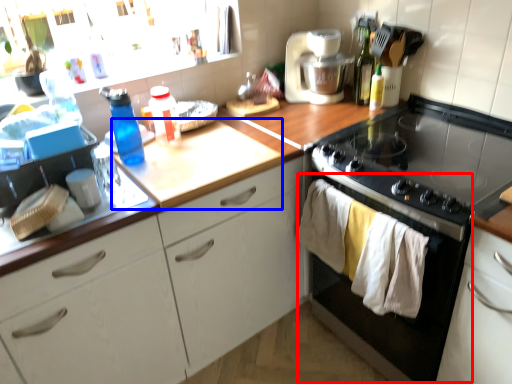
Question: Which object appears farthest to the camera in this image, oven (highlighted by a red box) or counter top (highlighted by a blue box)?

Choices:
 (A) oven
 (B) counter top

Answer: (B)